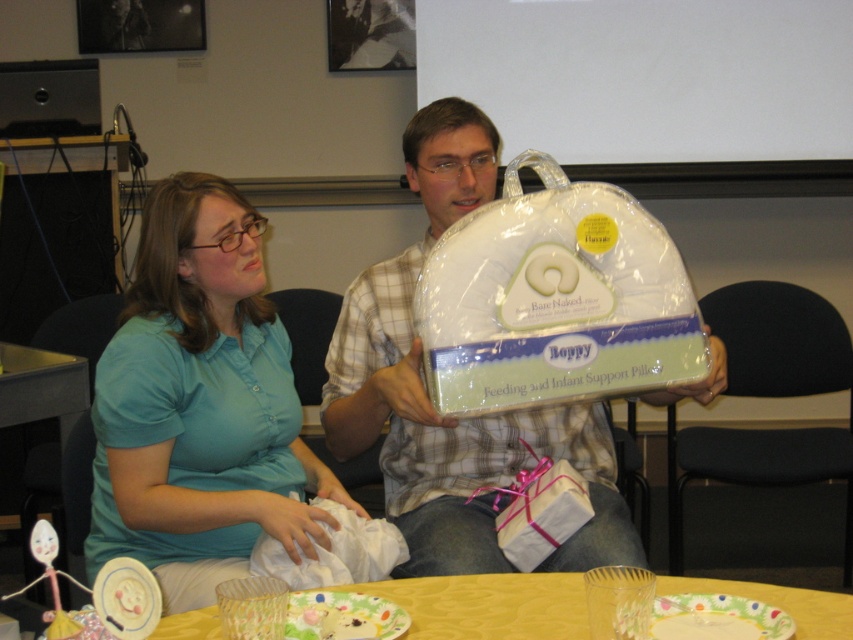
Is point (218, 276) in front of point (416, 330)?

No.

Identify the location of teal fabric shirt at center. (200, 404).

Who is lower down, teal fabric shirt at center or yellow fabric table at lower center?

yellow fabric table at lower center is below.

Locate an element on the screen. teal fabric shirt at center is located at coordinates (200, 404).

Who is lower down, white fabric pillow at center or yellow fabric table at lower center?

yellow fabric table at lower center is below.

How distant is white fabric pillow at center from yellow fabric table at lower center?

14.65 inches

You are a GUI agent. You are given a task and a screenshot of the screen. Output one action in this format:
    pyautogui.click(x=<x>, y=<y>)
    Task: Click on the white fabric pillow at center
    The height and width of the screenshot is (640, 853).
    Given the screenshot: What is the action you would take?
    [554, 300]

You are a GUI agent. You are given a task and a screenshot of the screen. Output one action in this format:
    pyautogui.click(x=<x>, y=<y>)
    Task: Click on the white fabric pillow at center
    The width and height of the screenshot is (853, 640).
    Given the screenshot: What is the action you would take?
    pyautogui.click(x=554, y=300)